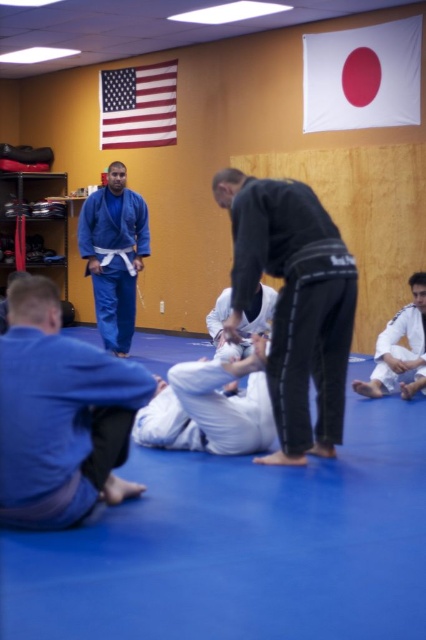
Question: Estimate the real-world distances between objects in this image. Which object is closer to the white fabric pants at center?

Choices:
 (A) black matte uniform at center
 (B) blue fabric gi at center
 (C) blue matte gi at lower left
 (D) white matte kimono at center

Answer: (A)

Question: Estimate the real-world distances between objects in this image. Which object is closer to the white matte kimono at center?

Choices:
 (A) blue fabric gi at center
 (B) blue matte gi at lower left

Answer: (B)

Question: Where is blue matte gi at lower left located in relation to black matte uniform at center in the image?

Choices:
 (A) above
 (B) below

Answer: (B)

Question: Is blue matte gi at lower left above white fabric pants at center?

Choices:
 (A) no
 (B) yes

Answer: (B)

Question: Is white fabric pants at center wider than blue fabric gi at center?

Choices:
 (A) no
 (B) yes

Answer: (B)

Question: Among these points, which one is nearest to the camera?

Choices:
 (A) coord(411,365)
 (B) coord(63,387)
 (C) coord(124,316)
 (D) coord(229,321)

Answer: (B)